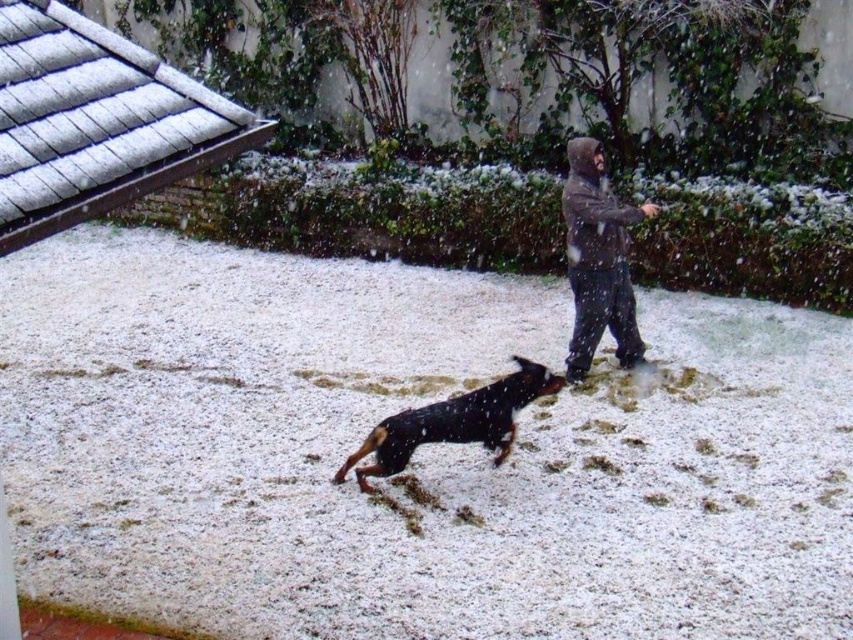
Question: Which point is farther from the camera taking this photo?

Choices:
 (A) (593, 298)
 (B) (480, 388)

Answer: (A)

Question: Does dark gray hoodie at center appear under black and tan fur dog at center?

Choices:
 (A) no
 (B) yes

Answer: (A)

Question: Which object is closer to the camera taking this photo?

Choices:
 (A) white fluffy snow at center
 (B) black and tan fur dog at center
 (C) dark gray hoodie at center

Answer: (A)

Question: Which point is closer to the camera?

Choices:
 (A) white fluffy snow at center
 (B) dark gray hoodie at center
 (C) black and tan fur dog at center

Answer: (A)

Question: In this image, where is white fluffy snow at center located relative to black and tan fur dog at center?

Choices:
 (A) left
 (B) right

Answer: (A)

Question: Is white fluffy snow at center smaller than dark gray hoodie at center?

Choices:
 (A) no
 (B) yes

Answer: (A)